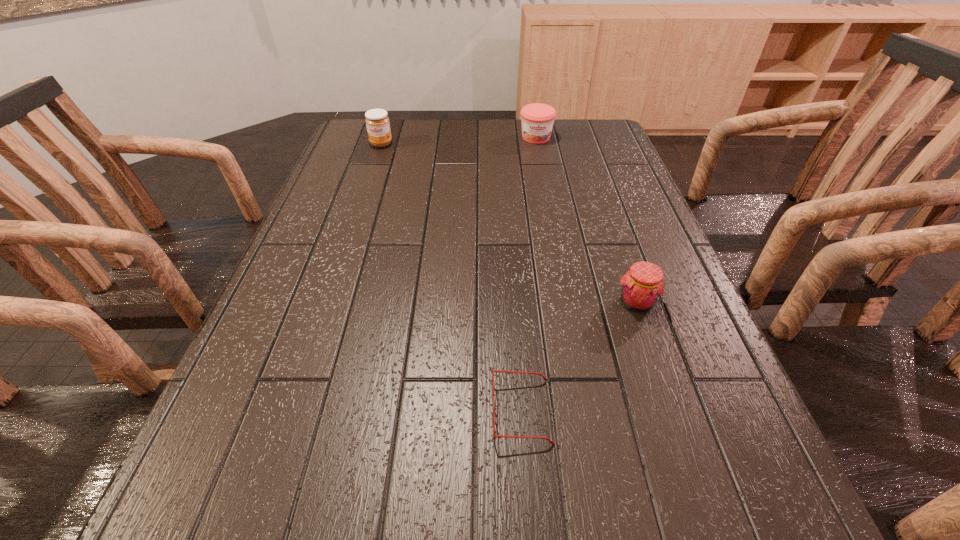
Locate an element on the screen. Image resolution: width=960 pixels, height=540 pixels. free spot located on the face of the shortest object is located at coordinates click(x=298, y=412).

The image size is (960, 540). Identify the location of blank area located 0.380m on the face of the shortest object. (261, 412).

I want to click on object that is at the left edge, so click(377, 122).

The height and width of the screenshot is (540, 960). In order to click on object present at the right edge in this screenshot , I will do `click(642, 285)`.

In order to click on object at the far left corner in this screenshot , I will do `click(377, 122)`.

Where is `free location at the far edge`? The height and width of the screenshot is (540, 960). free location at the far edge is located at coordinates (445, 150).

Where is `vacant region at the near edge`? The image size is (960, 540). vacant region at the near edge is located at coordinates (659, 515).

Locate an element on the screen. vacant position at the left edge of the desktop is located at coordinates (285, 374).

I want to click on free region at the right edge of the desktop, so click(681, 281).

At what (x,y) coordinates should I click in order to perform the action: click on vacant region at the far right corner of the desktop. Please return your answer as a coordinate pair (x, y). The image size is (960, 540). Looking at the image, I should click on (565, 131).